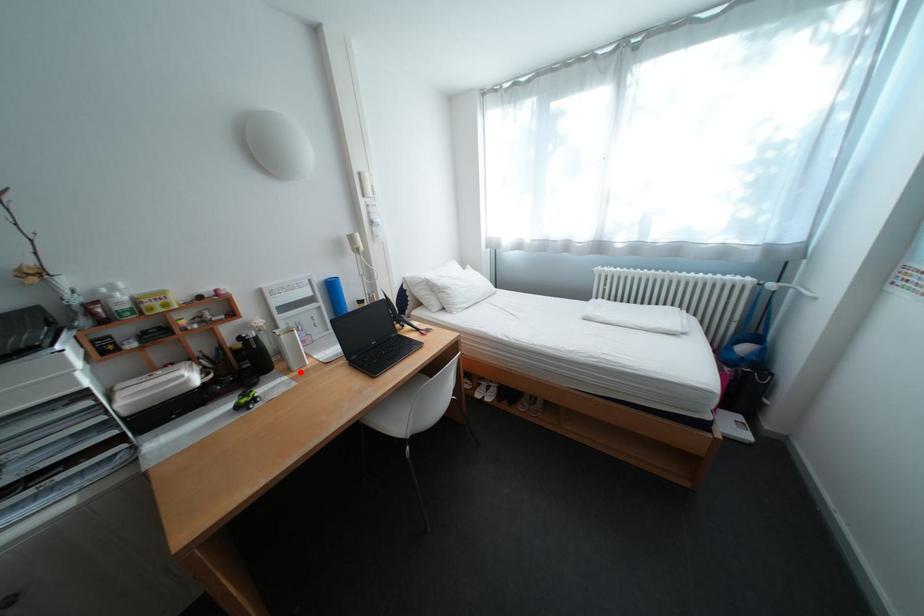
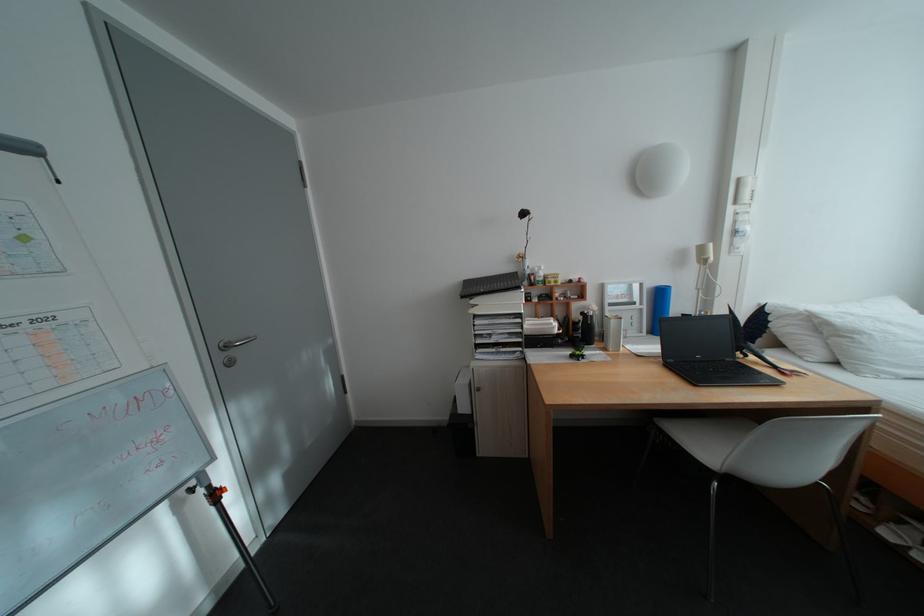
Locate, in the second image, the point that corresponds to the highlighted location in the first image.

(617, 350)